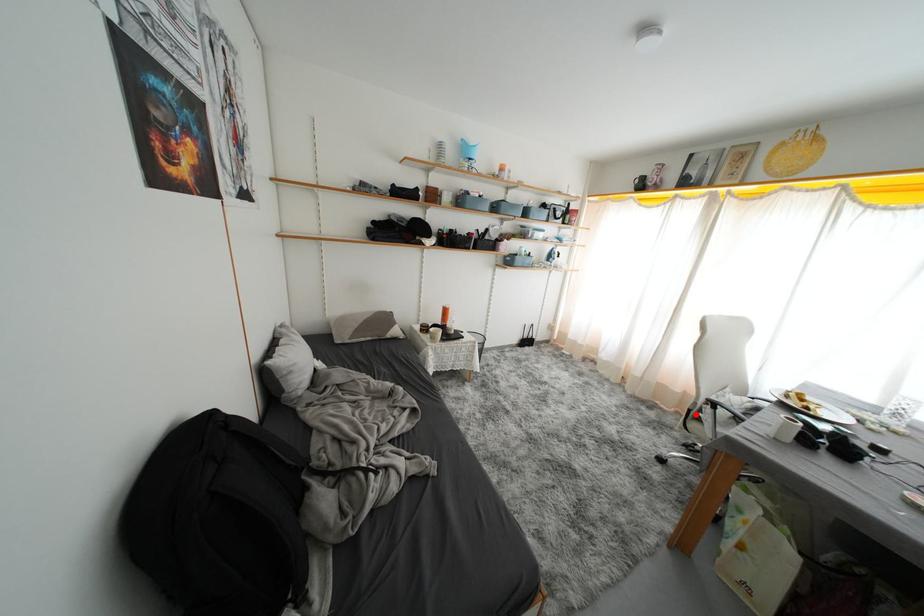
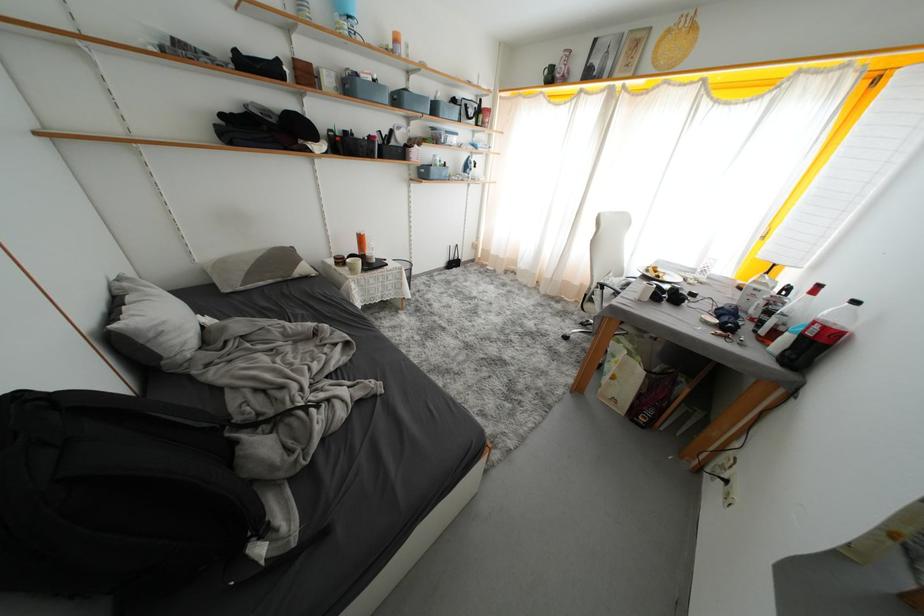
Question: A red point is marked in image1. In image2, is the corresponding 3D point closer to the camera or farther? Reply with the corresponding letter.

Choices:
 (A) The corresponding 3D point is closer.
 (B) The corresponding 3D point is farther.

Answer: (A)